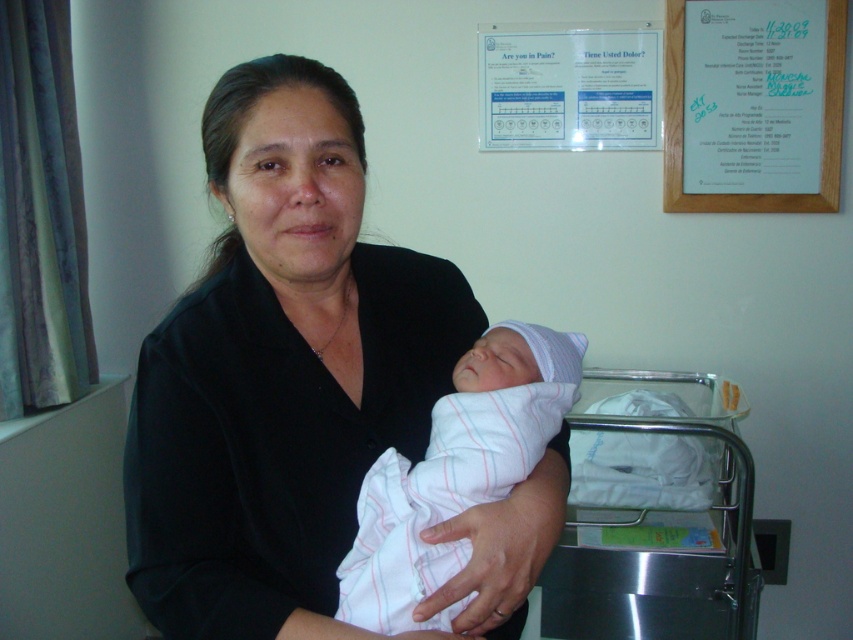
Which of these two, stainless steel hospital bed at lower right or white paper at upper right, stands taller?

stainless steel hospital bed at lower right

This screenshot has width=853, height=640. What do you see at coordinates (654, 522) in the screenshot?
I see `stainless steel hospital bed at lower right` at bounding box center [654, 522].

Does point (595, 609) come closer to viewer compared to point (718, 10)?

That is True.

Where is `stainless steel hospital bed at lower right`? The width and height of the screenshot is (853, 640). stainless steel hospital bed at lower right is located at coordinates (654, 522).

Could you measure the distance between stainless steel hospital bed at lower right and white striped fabric newborn at center?

A distance of 93.21 centimeters exists between stainless steel hospital bed at lower right and white striped fabric newborn at center.

Can you confirm if stainless steel hospital bed at lower right is shorter than white striped fabric newborn at center?

No, stainless steel hospital bed at lower right is not shorter than white striped fabric newborn at center.

Where is `stainless steel hospital bed at lower right`? This screenshot has width=853, height=640. stainless steel hospital bed at lower right is located at coordinates (654, 522).

Is the position of black matte shirt at center more distant than that of white paper at upper right?

No.

Between black matte shirt at center and white paper at upper right, which one appears on the right side from the viewer's perspective?

Answer: white paper at upper right is more to the right.

What do you see at coordinates (280, 371) in the screenshot?
I see `black matte shirt at center` at bounding box center [280, 371].

Where is `black matte shirt at center`? The width and height of the screenshot is (853, 640). black matte shirt at center is located at coordinates [280, 371].